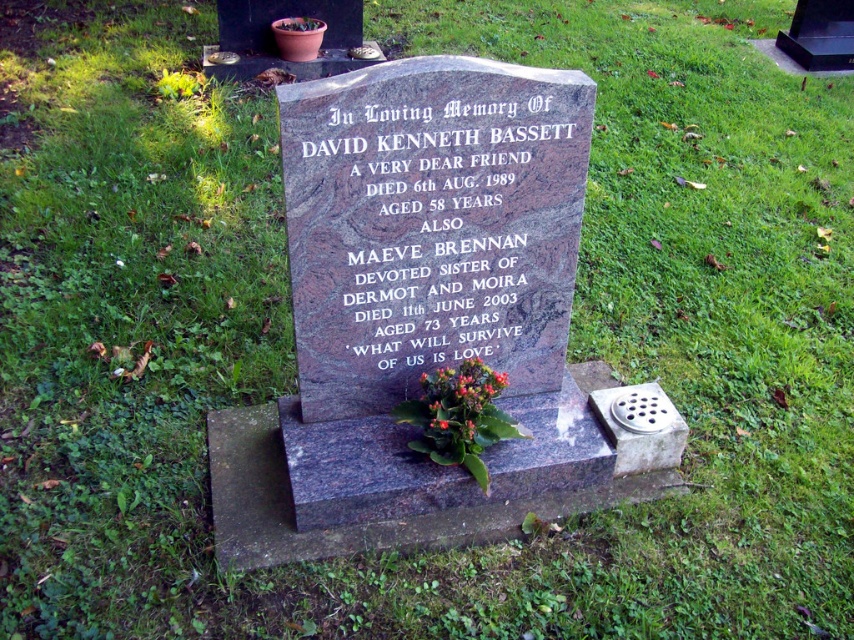
You are standing in a cemetery and want to place a bouquet of flowers at the base of the granite gravestone at center. If your arm reaches out 1.8 meters, can you place the bouquet without moving closer to the gravestone?

The granite gravestone at center is 1.91 meters away from the viewer. Since your arm reaches 1.8 meters, you cannot quite reach the gravestone, so you need to move closer to place the bouquet.

You are a gardener who wants to place a new small potted plant between the granite gravestone at center and the green leafy plant at center. Considering their sizes, which object should the potted plant be placed closer to?

The granite gravestone at center is larger than the green leafy plant at center, so the potted plant should be placed closer to the green leafy plant at center to maintain balance in the arrangement.

You are standing in a cemetery and see the granite stone plaque at center and the green leafy plant at center. Which object is positioned higher up?

The granite stone plaque at center is positioned above the green leafy plant at center.